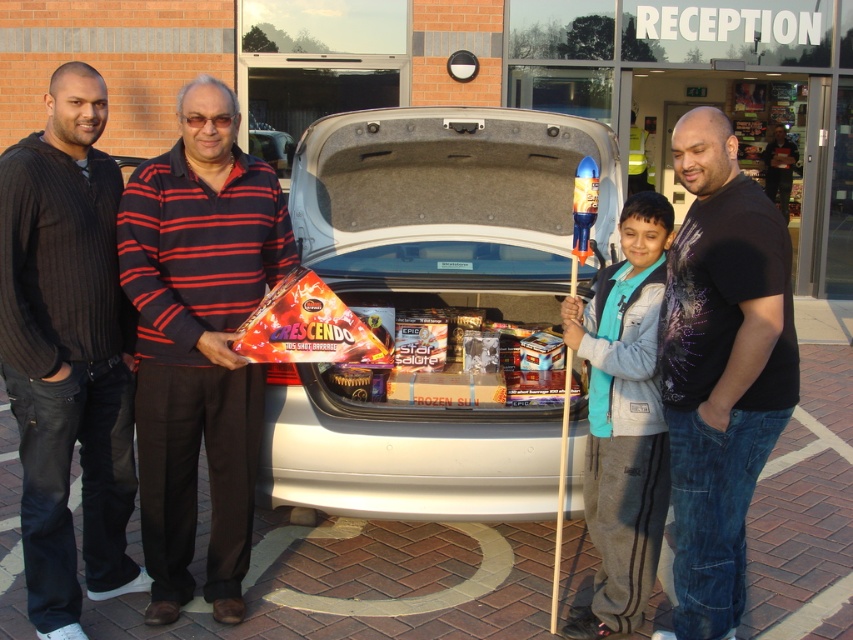
You are standing at the point labeled point (x=105, y=349) and want to walk to the car trunk which is at point (x=746, y=394). Are you facing the correct direction if you turn to your right?

Since point (x=105, y=349) is behind point (x=746, y=394), turning to your right would not face you towards the car trunk. You need to face forward to move towards the car trunk located at point (x=746, y=394).